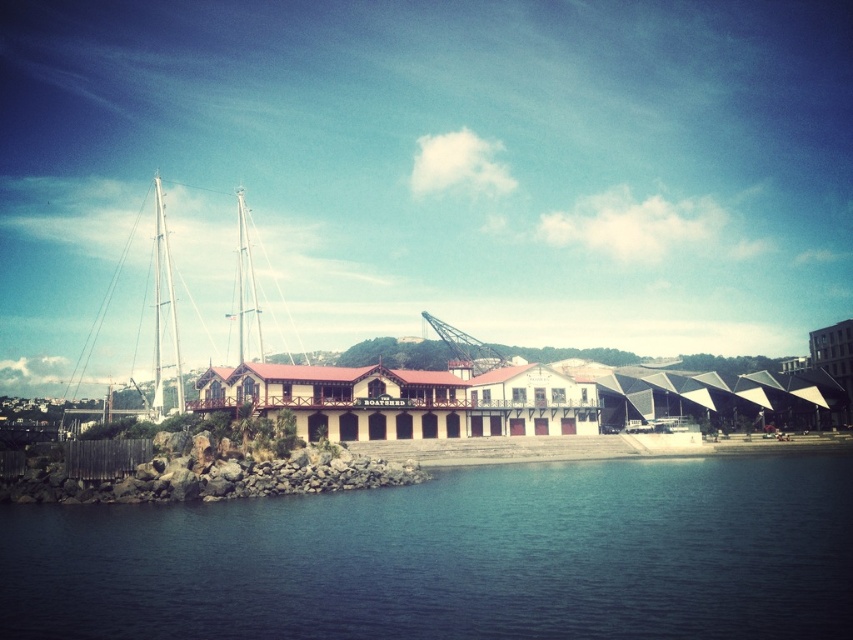
You are standing at the waterfront near the Boatshed. A drone is flying towards the point marked at coordinates point (164, 577). If the drone is currently 50 meters away from you, will it reach the point before it gets closer than 40 meters to you?

The point (164, 577) is 43.15 meters away from the viewer. Since the drone is currently 50 meters away and moving towards the point, it will pass the point at 43.15 meters, which is still farther than 40 meters. Therefore, the drone will reach the point before getting closer than 40 meters to you.